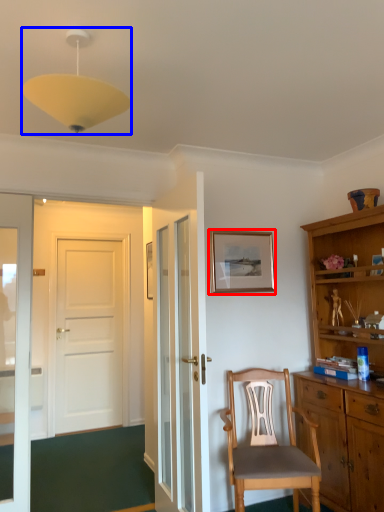
Question: Which of the following is the farthest to the observer, picture frame (highlighted by a red box) or light fixture (highlighted by a blue box)?

Choices:
 (A) picture frame
 (B) light fixture

Answer: (A)